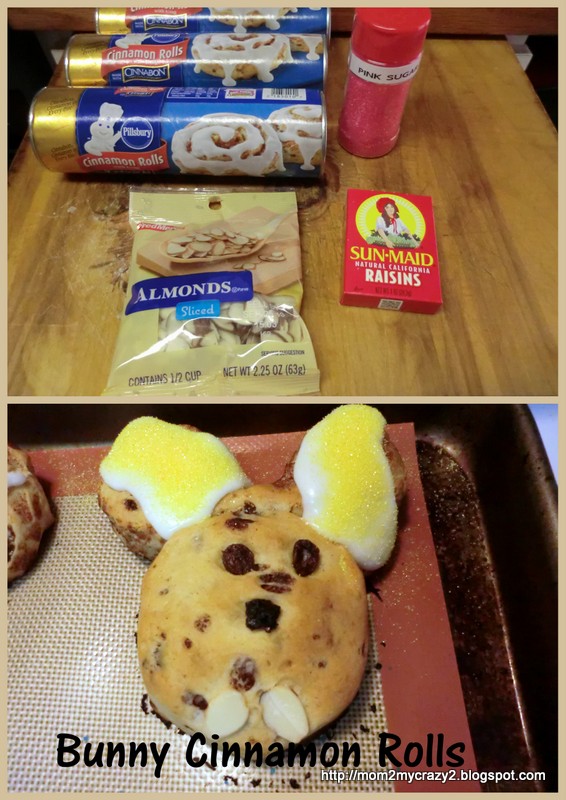
This screenshot has width=566, height=800. What are the coordinates of `paper liner` in the screenshot? It's located at (439, 697).